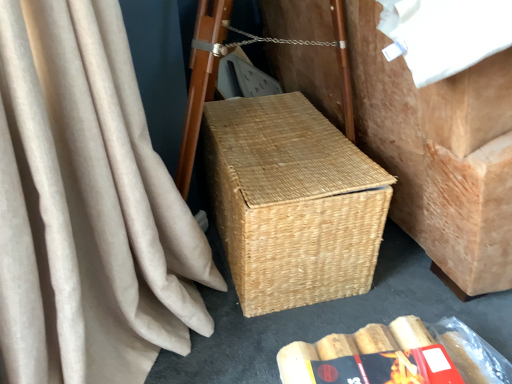
What is the approximate height of natural woven basket at center?

The height of natural woven basket at center is 32.13 inches.

The width and height of the screenshot is (512, 384). What do you see at coordinates (390, 368) in the screenshot?
I see `red matte paperback book at lower center` at bounding box center [390, 368].

What are the coordinates of `natural woven basket at center` in the screenshot? It's located at (439, 152).

Would you consider natural woven basket at center to be distant from natural woven picnic basket at center?

No.

Is natural woven basket at center spatially inside natural woven picnic basket at center, or outside of it?

The correct answer is: outside.

Measure the distance between natural woven basket at center and natural woven picnic basket at center.

They are 26.42 centimeters apart.

Is natural woven basket at center bigger than natural woven picnic basket at center?

Indeed, natural woven basket at center has a larger size compared to natural woven picnic basket at center.

Between red matte paperback book at lower center and natural woven basket at center, which one appears on the left side from the viewer's perspective?

From the viewer's perspective, red matte paperback book at lower center appears more on the left side.

In the image, there is a natural woven basket at center. Find the location of `paperback book below it (from the image's perspective)`. paperback book below it (from the image's perspective) is located at coordinates (390, 368).

Is natural woven basket at center inside red matte paperback book at lower center?

No, natural woven basket at center is not a part of red matte paperback book at lower center.

Between natural woven basket at center and red matte paperback book at lower center, which one has more height?

natural woven basket at center.

Can you confirm if natural woven basket at center is thinner than red matte paperback book at lower center?

No.

What's the angular difference between natural woven basket at center and red matte paperback book at lower center's facing directions?

A: 102 degrees separate the facing orientations of natural woven basket at center and red matte paperback book at lower center.

From a real-world perspective, which is physically below, natural woven basket at center or red matte paperback book at lower center?

In real-world perspective, red matte paperback book at lower center is lower.

Considering the relative sizes of woven brown basket at center and red matte paperback book at lower center in the image provided, is woven brown basket at center wider than red matte paperback book at lower center?

Yes.

Does woven brown basket at center turn towards red matte paperback book at lower center?

No.

Which is more to the left, woven brown basket at center or red matte paperback book at lower center?

→ red matte paperback book at lower center is more to the left.

Which object is further away from the camera taking this photo, natural woven picnic basket at center or natural woven basket at center?

natural woven picnic basket at center is behind.

Does natural woven picnic basket at center turn towards natural woven basket at center?

Yes, natural woven picnic basket at center faces towards natural woven basket at center.

Is natural woven basket at center located within natural woven picnic basket at center?

No, natural woven basket at center is not surrounded by natural woven picnic basket at center.

In the scene shown: Between natural woven picnic basket at center and natural woven basket at center, which one has larger size?

natural woven basket at center is bigger.

In terms of width, does woven brown basket at center look wider or thinner when compared to natural woven basket at center?

Considering their sizes, woven brown basket at center looks slimmer than natural woven basket at center.

In the image, is woven brown basket at center positioned in front of or behind natural woven basket at center?

In the image, woven brown basket at center appears behind natural woven basket at center.

From the image's perspective, which object appears higher, woven brown basket at center or natural woven basket at center?

natural woven basket at center appears higher in the image.

Looking at this image, in terms of height, does woven brown basket at center look taller or shorter compared to natural woven basket at center?

Clearly, woven brown basket at center is shorter compared to natural woven basket at center.

From the picture: Is red matte paperback book at lower center located within natural woven picnic basket at center?

No, red matte paperback book at lower center is not a part of natural woven picnic basket at center.

Identify the location of paperback book below the natural woven picnic basket at center (from the image's perspective). Image resolution: width=512 pixels, height=384 pixels. (390, 368).

Is natural woven picnic basket at center in contact with red matte paperback book at lower center?

No, natural woven picnic basket at center is not beside red matte paperback book at lower center.

Is the depth of natural woven picnic basket at center less than that of red matte paperback book at lower center?

No.

At what (x,y) coordinates should I click in order to perform the action: click on picnic basket that is below the natural woven basket at center (from the image's perspective). Please return your answer as a coordinate pair (x, y). The height and width of the screenshot is (384, 512). Looking at the image, I should click on (292, 202).

You are a GUI agent. You are given a task and a screenshot of the screen. Output one action in this format:
    pyautogui.click(x=<x>, y=<y>)
    Task: Click on the furniture in front of the red matte paperback book at lower center
    Image resolution: width=512 pixels, height=384 pixels.
    Given the screenshot: What is the action you would take?
    pyautogui.click(x=439, y=152)

From the image, which object appears to be farther from natural woven basket at center, natural woven picnic basket at center or woven brown basket at center?

Among the two, woven brown basket at center is located further to natural woven basket at center.

From the image, which object appears to be farther from red matte paperback book at lower center, woven brown basket at center or natural woven basket at center?

The object further to red matte paperback book at lower center is natural woven basket at center.

Based on their spatial positions, is natural woven picnic basket at center or red matte paperback book at lower center closer to woven brown basket at center?

Among the two, red matte paperback book at lower center is located nearer to woven brown basket at center.

Which object lies nearer to the anchor point natural woven picnic basket at center, red matte paperback book at lower center or woven brown basket at center?

woven brown basket at center lies closer to natural woven picnic basket at center than the other object.

From the image, which object appears to be nearer to natural woven basket at center, woven brown basket at center or red matte paperback book at lower center?

The object closer to natural woven basket at center is woven brown basket at center.

Looking at the image, which one is located closer to red matte paperback book at lower center, natural woven picnic basket at center or woven brown basket at center?

woven brown basket at center.

Looking at the image, which one is located closer to natural woven picnic basket at center, natural woven basket at center or woven brown basket at center?

natural woven basket at center lies closer to natural woven picnic basket at center than the other object.

From the image, which object appears to be nearer to natural woven picnic basket at center, red matte paperback book at lower center or natural woven basket at center?

natural woven basket at center.

Locate an element on the screen. This screenshot has height=384, width=512. paperback book between natural woven basket at center and woven brown basket at center vertically is located at coordinates (390, 368).

In order to click on picnic basket between natural woven basket at center and woven brown basket at center in the up-down direction in this screenshot , I will do `click(292, 202)`.

This screenshot has height=384, width=512. Identify the location of picnic basket between natural woven basket at center and red matte paperback book at lower center in the vertical direction. (292, 202).

The width and height of the screenshot is (512, 384). What are the coordinates of `paperback book that lies between natural woven picnic basket at center and woven brown basket at center from top to bottom` in the screenshot? It's located at (390, 368).